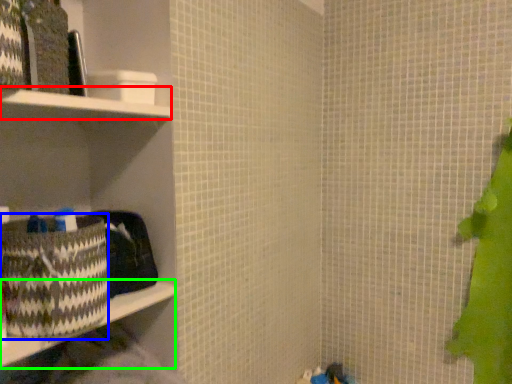
Question: Considering the real-world distances, which object is closest to cabinet (highlighted by a red box)? waste (highlighted by a blue box) or ledge (highlighted by a green box).

Choices:
 (A) waste
 (B) ledge

Answer: (A)